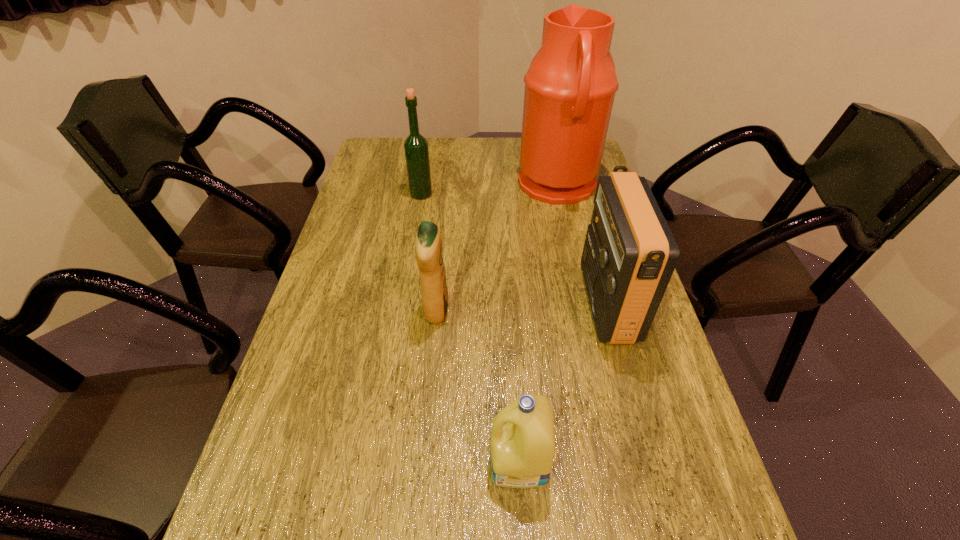
Point out which object is positioned as the fourth nearest to the water jug. Please provide its 2D coordinates. Your answer should be formatted as a tuple, i.e. [(x, y)], where the tuple contains the x and y coordinates of a point satisfying the conditions above.

[(522, 449)]

Choose which object is the third nearest neighbor to the shorter detergent. Please provide its 2D coordinates. Your answer should be formatted as a tuple, i.e. [(x, y)], where the tuple contains the x and y coordinates of a point satisfying the conditions above.

[(570, 87)]